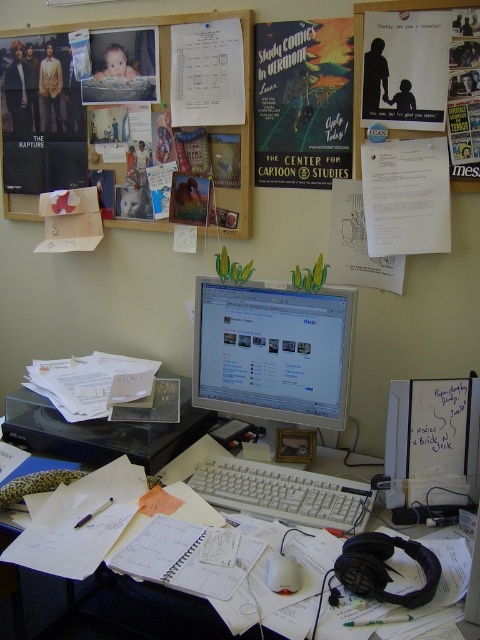
Who is higher up, white plastic keyboard at center or matte plastic baby at upper left?

matte plastic baby at upper left is above.

Image resolution: width=480 pixels, height=640 pixels. Identify the location of white plastic keyboard at center. (284, 493).

Does white glossy monitor at center appear over wooden corkboard at upper left?

Actually, white glossy monitor at center is below wooden corkboard at upper left.

Who is more forward, [301,390] or [36,26]?

Positioned in front is point [301,390].

Which is behind, point (300, 403) or point (154, 17)?

The point (154, 17) is behind.

Find the location of a particular element. The width and height of the screenshot is (480, 640). white glossy monitor at center is located at coordinates (273, 352).

Does wooden corkboard at upper left appear under white matte mouse at center?

Actually, wooden corkboard at upper left is above white matte mouse at center.

This screenshot has height=640, width=480. Find the location of `wooden corkboard at upper left`. wooden corkboard at upper left is located at coordinates (168, 92).